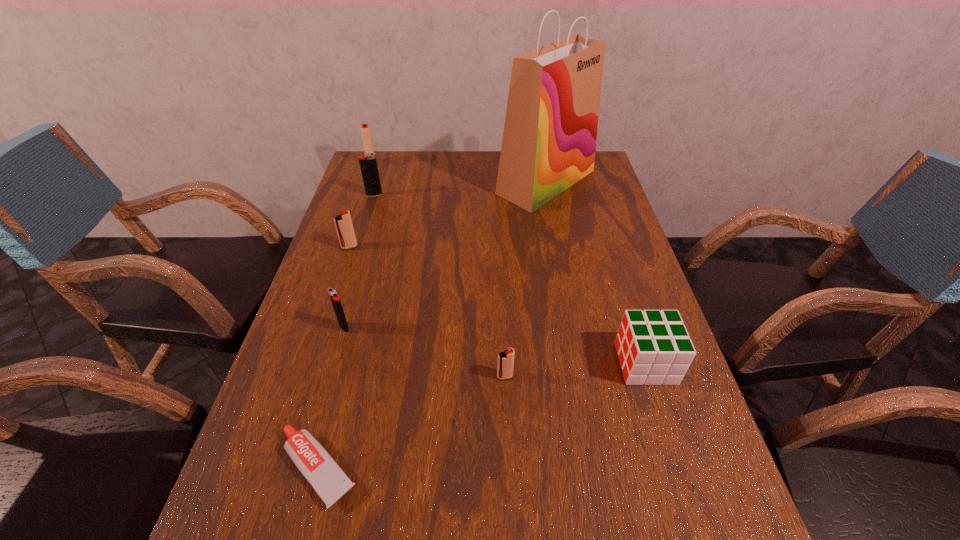
At what (x,y) coordinates should I click in order to perform the action: click on shopping bag. Please return your answer as a coordinate pair (x, y). The image size is (960, 540). Looking at the image, I should click on (549, 141).

I want to click on the farthest red igniter, so click(365, 129).

At what (x,y) coordinates should I click in order to perform the action: click on the farthest igniter. Please return your answer as a coordinate pair (x, y). Looking at the image, I should click on (365, 129).

Locate an element on the screen. The width and height of the screenshot is (960, 540). the bigger black igniter is located at coordinates click(368, 164).

This screenshot has width=960, height=540. I want to click on the farther black igniter, so click(368, 164).

Find the location of a particular element. The height and width of the screenshot is (540, 960). the fourth farthest igniter is located at coordinates (338, 309).

Locate an element on the screen. the nearer black igniter is located at coordinates (338, 309).

The width and height of the screenshot is (960, 540). I want to click on the second farthest red igniter, so click(343, 223).

The width and height of the screenshot is (960, 540). In order to click on the second biggest red igniter in this screenshot , I will do `click(343, 223)`.

The width and height of the screenshot is (960, 540). I want to click on red cube, so click(x=654, y=347).